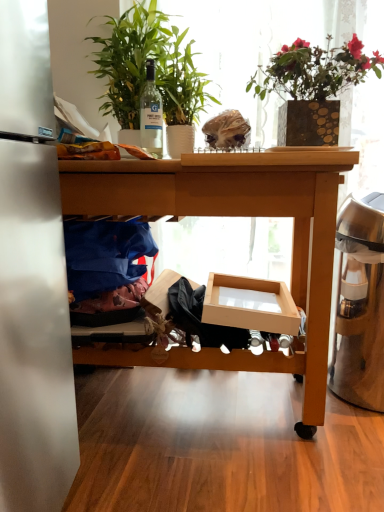
The width and height of the screenshot is (384, 512). What are the coordinates of `green leafy plant at upper left, marked as the first houseplant in a left-to-right arrangement` in the screenshot? It's located at (144, 67).

Describe the element at coordinates (151, 114) in the screenshot. The image size is (384, 512). I see `clear glass bottle at center` at that location.

The width and height of the screenshot is (384, 512). I want to click on satin silver trash can at right, so click(363, 309).

Considering the sizes of wooden desk at center and gold textured vase at upper right, marked as the second houseplant in a left-to-right arrangement, in the image, is wooden desk at center taller or shorter than gold textured vase at upper right, marked as the second houseplant in a left-to-right arrangement,?

Considering their sizes, wooden desk at center has more height than gold textured vase at upper right, marked as the second houseplant in a left-to-right arrangement.

This screenshot has width=384, height=512. Find the location of `desk directly beneath the gold textured vase at upper right, placed as the first houseplant when sorted from right to left (from a real-world perspective)`. desk directly beneath the gold textured vase at upper right, placed as the first houseplant when sorted from right to left (from a real-world perspective) is located at coordinates (236, 216).

Consider the image. Is wooden desk at center behind gold textured vase at upper right, placed as the first houseplant when sorted from right to left?

No, it is in front of gold textured vase at upper right, placed as the first houseplant when sorted from right to left.

From the image's perspective, would you say cardboard box at center is shown under clear glass bottle at center?

Yes, from the image's perspective, cardboard box at center is below clear glass bottle at center.

Are cardboard box at center and clear glass bottle at center making contact?

cardboard box at center and clear glass bottle at center are not in contact.

Visually, is cardboard box at center positioned to the left or to the right of clear glass bottle at center?

cardboard box at center is to the right of clear glass bottle at center.

Identify the location of cardboard box in front of the clear glass bottle at center. (250, 304).

Is satin silver trash can at right facing away from clear glass bottle at center?

That's not correct — satin silver trash can at right is not looking away from clear glass bottle at center.

What are the coordinates of `trash bin/can below the clear glass bottle at center (from a real-world perspective)` in the screenshot? It's located at (363, 309).

Is satin silver trash can at right at the left side of clear glass bottle at center?

No.

Considering the sizes of objects satin silver trash can at right and clear glass bottle at center in the image provided, who is wider, satin silver trash can at right or clear glass bottle at center?

With larger width is satin silver trash can at right.

From the image's perspective, is clear glass bottle at center located above or below satin silver trash can at right?

Based on their image positions, clear glass bottle at center is located above satin silver trash can at right.

Is the depth of clear glass bottle at center less than that of satin silver trash can at right?

No, clear glass bottle at center is further to the viewer.

From their relative heights in the image, would you say clear glass bottle at center is taller or shorter than satin silver trash can at right?

Clearly, clear glass bottle at center is shorter compared to satin silver trash can at right.

Which is more distant, (152, 118) or (346, 225)?

The point (152, 118) is behind.

From the image's perspective, which object appears higher, green leafy plant at upper left, which is counted as the 2th houseplant, starting from the right, or wooden desk at center?

green leafy plant at upper left, which is counted as the 2th houseplant, starting from the right, is shown above in the image.

Considering the positions of objects green leafy plant at upper left, which is counted as the 2th houseplant, starting from the right, and wooden desk at center in the image provided, who is in front, green leafy plant at upper left, which is counted as the 2th houseplant, starting from the right, or wooden desk at center?

wooden desk at center is closer to the camera.

Measure the distance from green leafy plant at upper left, which is counted as the 2th houseplant, starting from the right, to wooden desk at center.

green leafy plant at upper left, which is counted as the 2th houseplant, starting from the right, and wooden desk at center are 21.08 inches apart.

From the picture: Can you confirm if green leafy plant at upper left, which is counted as the 2th houseplant, starting from the right, is wider than satin silver trash can at right?

Correct, the width of green leafy plant at upper left, which is counted as the 2th houseplant, starting from the right, exceeds that of satin silver trash can at right.

How many degrees apart are the facing directions of green leafy plant at upper left, marked as the first houseplant in a left-to-right arrangement, and satin silver trash can at right?

The facing directions of green leafy plant at upper left, marked as the first houseplant in a left-to-right arrangement, and satin silver trash can at right are 6.19 degrees apart.

Is green leafy plant at upper left, marked as the first houseplant in a left-to-right arrangement, positioned far away from satin silver trash can at right?

Actually, green leafy plant at upper left, marked as the first houseplant in a left-to-right arrangement, and satin silver trash can at right are a little close together.

Does green leafy plant at upper left, marked as the first houseplant in a left-to-right arrangement, turn towards satin silver trash can at right?

No, green leafy plant at upper left, marked as the first houseplant in a left-to-right arrangement, is not aimed at satin silver trash can at right.

Based on the photo, from the image's perspective, is gold textured vase at upper right, marked as the second houseplant in a left-to-right arrangement, on cardboard box at center?

Yes, from the image's perspective, gold textured vase at upper right, marked as the second houseplant in a left-to-right arrangement, is over cardboard box at center.

Is gold textured vase at upper right, marked as the second houseplant in a left-to-right arrangement, thinner than cardboard box at center?

Yes.

Are gold textured vase at upper right, marked as the second houseplant in a left-to-right arrangement, and cardboard box at center beside each other?

No, gold textured vase at upper right, marked as the second houseplant in a left-to-right arrangement, is not beside cardboard box at center.

What's the angular difference between gold textured vase at upper right, placed as the first houseplant when sorted from right to left, and cardboard box at center's facing directions?

4.14 degrees.

Locate an element on the screen. The width and height of the screenshot is (384, 512). desk located underneath the gold textured vase at upper right, placed as the first houseplant when sorted from right to left (from a real-world perspective) is located at coordinates (236, 216).

I want to click on bottle that appears behind the cardboard box at center, so click(151, 114).

Looking at the image, which one is located further to gold textured vase at upper right, placed as the first houseplant when sorted from right to left, satin silver trash can at right or cardboard box at center?

The object further to gold textured vase at upper right, placed as the first houseplant when sorted from right to left, is cardboard box at center.

Which object lies further to the anchor point wooden desk at center, cardboard box at center or green leafy plant at upper left, marked as the first houseplant in a left-to-right arrangement?

Among the two, green leafy plant at upper left, marked as the first houseplant in a left-to-right arrangement, is located further to wooden desk at center.

When comparing their distances from wooden desk at center, does clear glass bottle at center or cardboard box at center seem further?

clear glass bottle at center is further to wooden desk at center.

Looking at the image, which one is located further to clear glass bottle at center, wooden desk at center or satin silver trash can at right?

satin silver trash can at right lies further to clear glass bottle at center than the other object.

Estimate the real-world distances between objects in this image. Which object is closer to clear glass bottle at center, satin silver trash can at right or wooden desk at center?

wooden desk at center lies closer to clear glass bottle at center than the other object.

Which object lies further to the anchor point clear glass bottle at center, satin silver trash can at right or gold textured vase at upper right, placed as the first houseplant when sorted from right to left?

satin silver trash can at right is positioned further to the anchor clear glass bottle at center.

Based on the photo, based on their spatial positions, is gold textured vase at upper right, placed as the first houseplant when sorted from right to left, or wooden desk at center closer to cardboard box at center?

wooden desk at center.

Estimate the real-world distances between objects in this image. Which object is closer to green leafy plant at upper left, marked as the first houseplant in a left-to-right arrangement, wooden desk at center or gold textured vase at upper right, marked as the second houseplant in a left-to-right arrangement?

gold textured vase at upper right, marked as the second houseplant in a left-to-right arrangement, is positioned closer to the anchor green leafy plant at upper left, marked as the first houseplant in a left-to-right arrangement.

Where is `desk located between green leafy plant at upper left, marked as the first houseplant in a left-to-right arrangement, and satin silver trash can at right in the left-right direction`? desk located between green leafy plant at upper left, marked as the first houseplant in a left-to-right arrangement, and satin silver trash can at right in the left-right direction is located at coordinates (236, 216).

This screenshot has height=512, width=384. In order to click on bottle between green leafy plant at upper left, marked as the first houseplant in a left-to-right arrangement, and wooden desk at center, in the vertical direction in this screenshot , I will do click(x=151, y=114).

Image resolution: width=384 pixels, height=512 pixels. What are the coordinates of `bottle between green leafy plant at upper left, which is counted as the 2th houseplant, starting from the right, and cardboard box at center vertically` in the screenshot? It's located at (151, 114).

The image size is (384, 512). Identify the location of desk between gold textured vase at upper right, marked as the second houseplant in a left-to-right arrangement, and cardboard box at center from top to bottom. (236, 216).